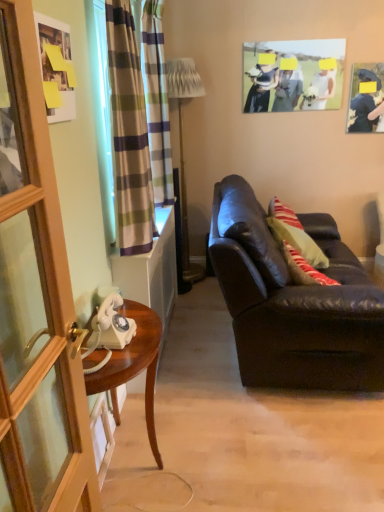
Find the location of a particular element. The image size is (384, 512). vacant area located to the right-hand side of wooden desk at left is located at coordinates (218, 458).